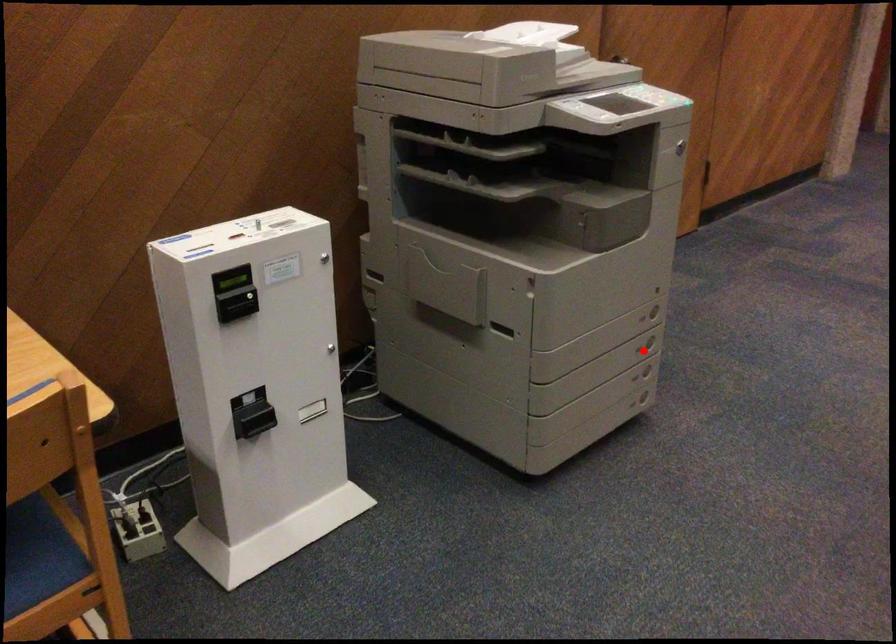
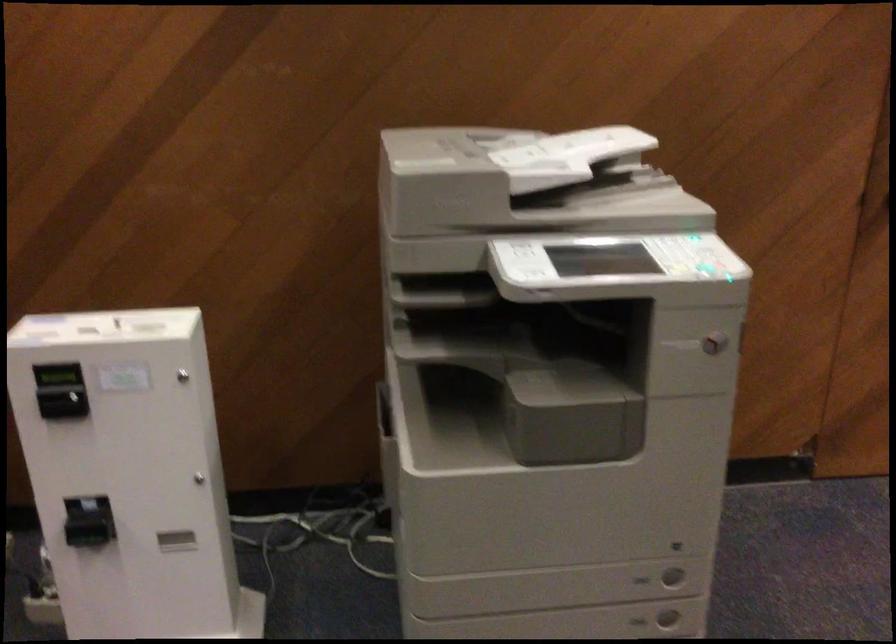
Question: I am providing you with two images of the same scene from different viewpoints. A red point is marked on the first image. Is the red point's position out of view in image 2?

Choices:
 (A) Yes
 (B) No

Answer: (B)